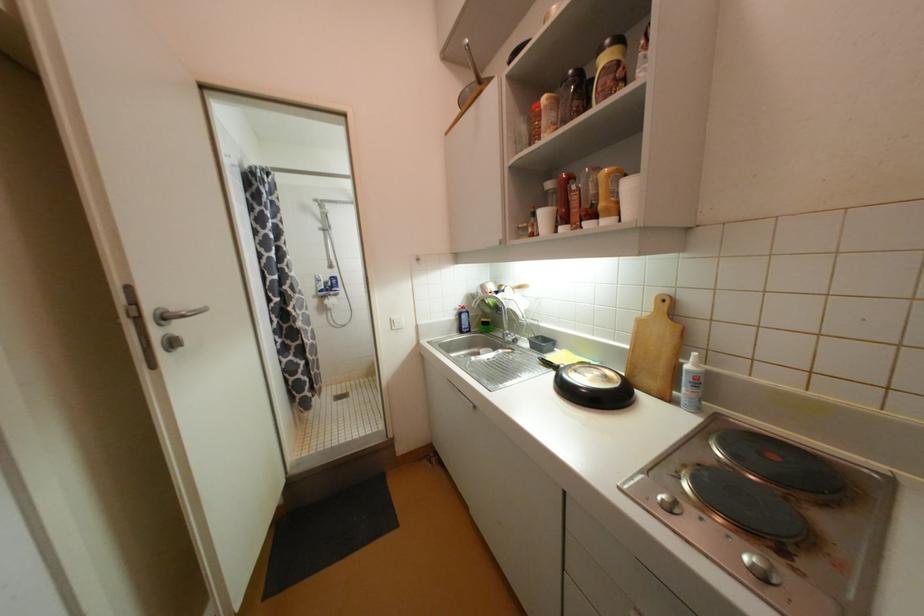
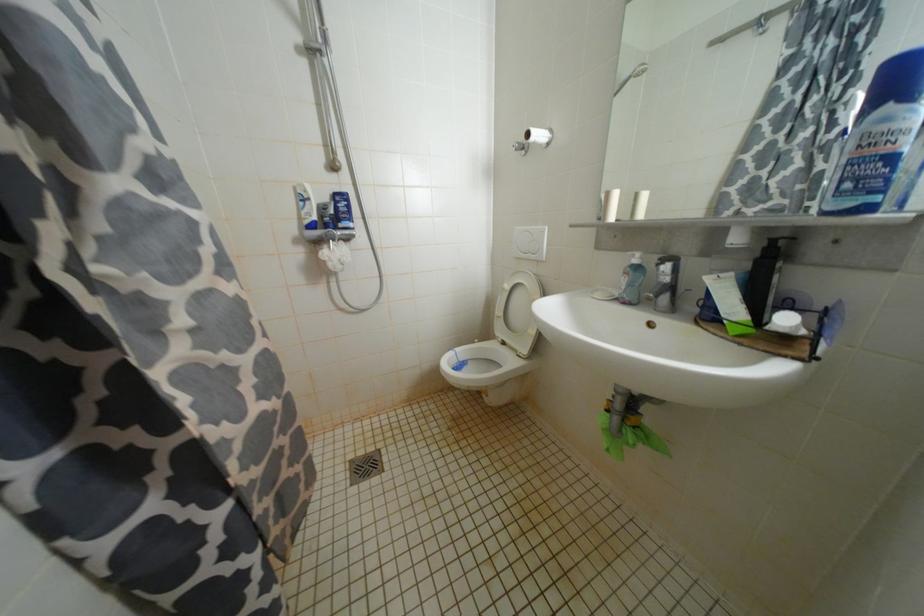
Locate, in the second image, the point that corresponds to the point at 338,280 in the first image.

(345, 198)